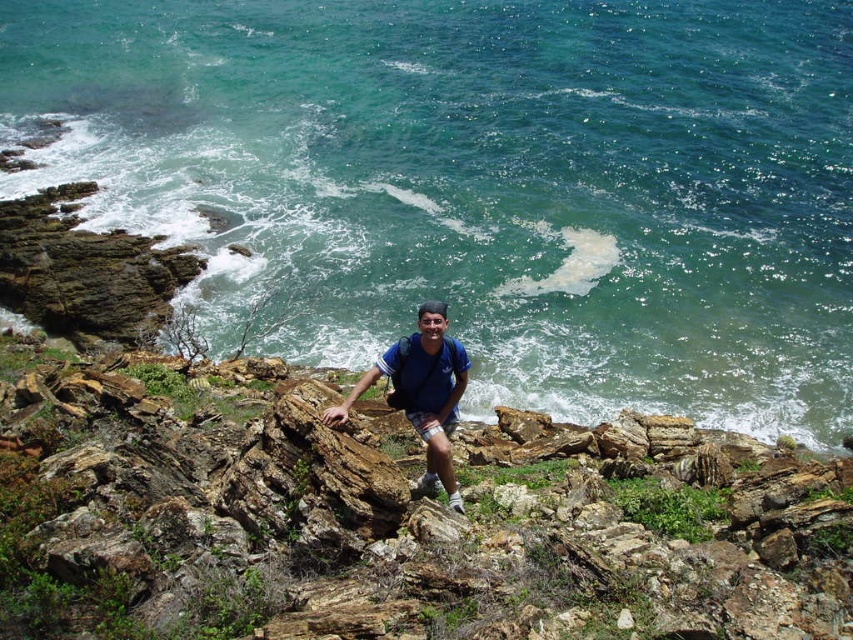
You are a photographer trying to capture the green water at upper center in your shot. Based on the scene, where should you position your camera relative to the man?

The green water at upper center is located at point [483,182], so you should position your camera slightly to the left and above the man to capture it.

You are a photographer trying to capture the man in the blue fabric shirt at center while ensuring the green water at upper center is also in focus. Based on their positions, will both objects be in focus at the same time?

The green water at upper center is further to the viewer than blue fabric shirt at center, so they are at different distances. This means the depth of field may not capture both in focus simultaneously unless adjusted.